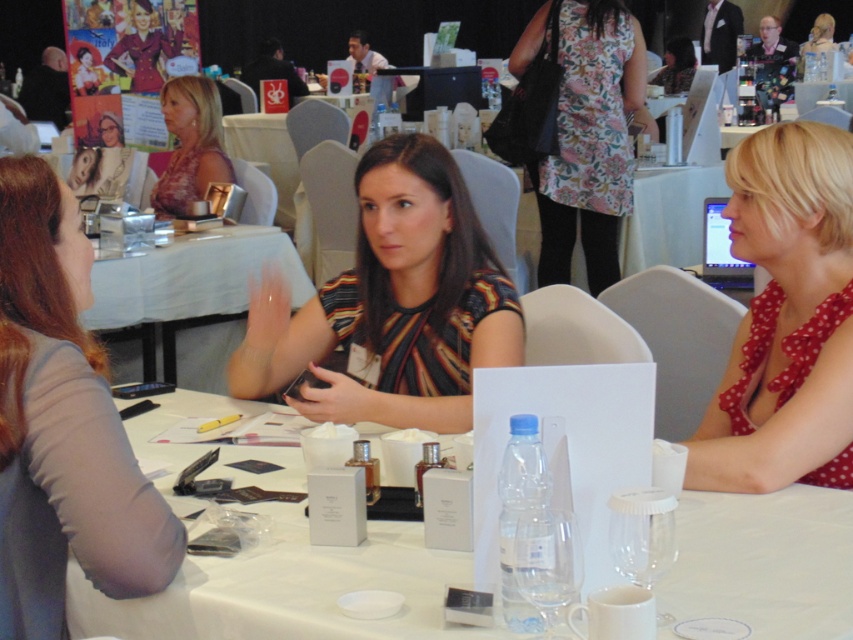
You are organizing a presentation and need to place a name tag on the table. The name tag is the same height as the white paper at center. Can the name tag fit vertically between the gray fabric shirt at left and the edge of the table without overlapping?

The gray fabric shirt at left is taller than the white paper at center. Since the name tag has the same height as the white paper, it can fit vertically between the gray fabric shirt at left and the table edge as long as there is enough space below the shirt.

You are organizing a presentation and need to determine which item is shorter between the striped fabric shirt at center and the white paper at center. Based on the scene description, which one should you choose?

The striped fabric shirt at center is not as tall as white paper at center, so you should choose the striped fabric shirt at center as the shorter item.

You are standing at the conference table and want to reach both the point at coordinates (250, 408) and the point at coordinates (103, 355). Which point will you reach first?

You will reach the point at coordinates (250, 408) first because it is closer to you than the point at coordinates (103, 355), which is further away.